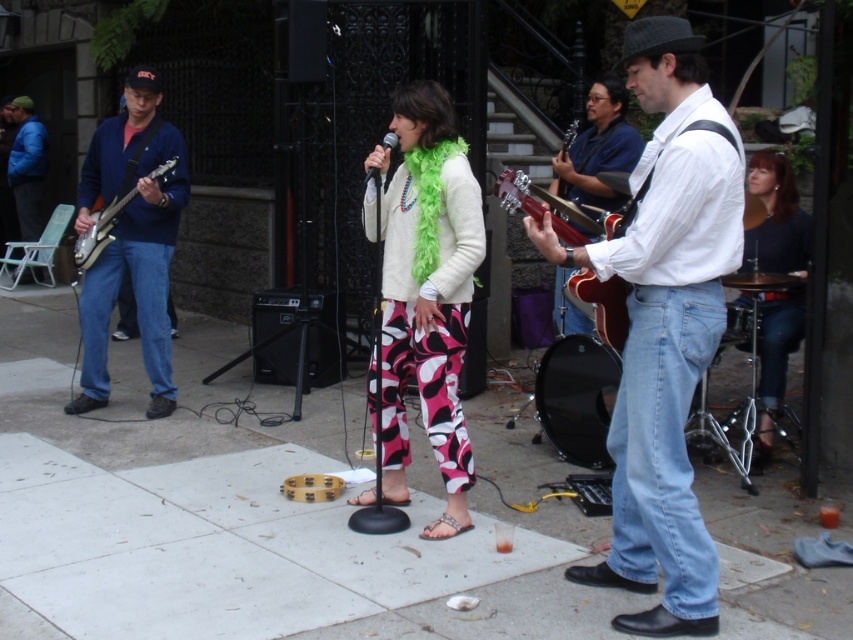
Can you confirm if white concrete sidewalk at center is bigger than blue denim jeans at left?

No, white concrete sidewalk at center is not bigger than blue denim jeans at left.

Is white concrete sidewalk at center in front of blue denim jeans at left?

Yes, white concrete sidewalk at center is closer to the viewer.

Between point (252, 566) and point (180, 140), which one is positioned in front?

Positioned in front is point (252, 566).

Locate an element on the screen. The width and height of the screenshot is (853, 640). white concrete sidewalk at center is located at coordinates (242, 524).

Is shiny red electric guitar at center bigger than blue denim jacket at left?

No.

Can you confirm if shiny red electric guitar at center is positioned below blue denim jacket at left?

Indeed, shiny red electric guitar at center is positioned under blue denim jacket at left.

Locate an element on the screen. The image size is (853, 640). shiny red electric guitar at center is located at coordinates (550, 209).

Based on the photo, which is above, white concrete sidewalk at center or shiny brown guitar at center?

shiny brown guitar at center

Does white concrete sidewalk at center have a lesser width compared to shiny brown guitar at center?

Incorrect, white concrete sidewalk at center's width is not less than shiny brown guitar at center's.

Who is more forward, (41,353) or (573,189)?

Point (573,189) is more forward.

I want to click on white concrete sidewalk at center, so click(x=242, y=524).